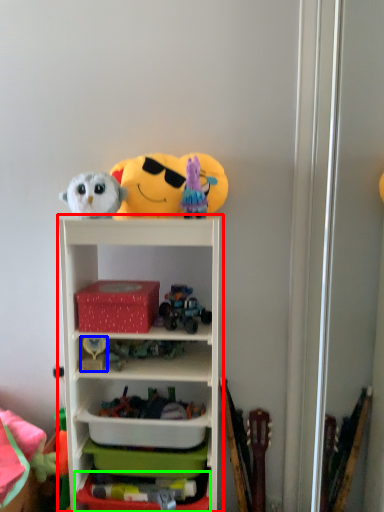
Question: Based on their relative distances, which object is nearer to shelf (highlighted by a red box)? Choose from toy (highlighted by a blue box) and storage box (highlighted by a green box).

Choices:
 (A) toy
 (B) storage box

Answer: (A)